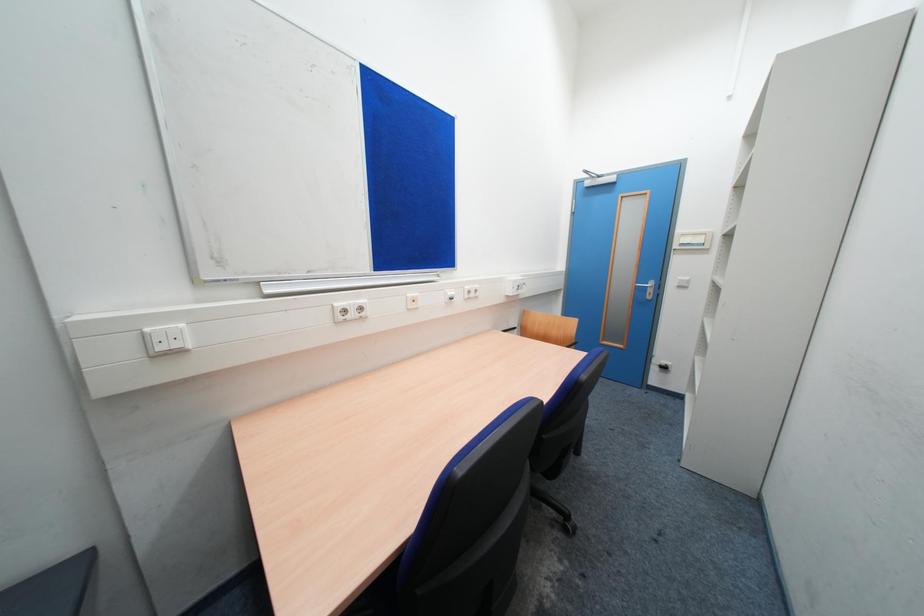
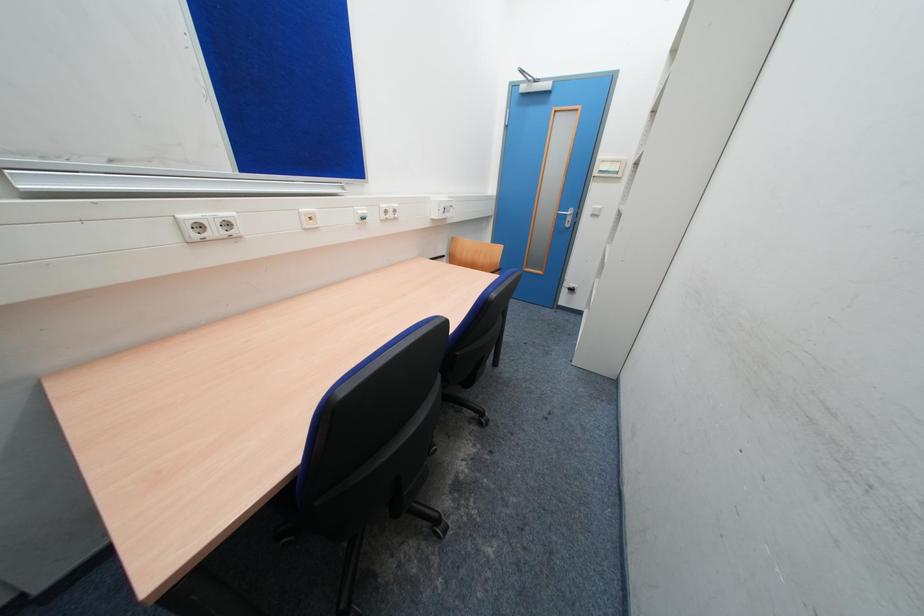
What movement of the cameraman would produce the second image?

The cameraman moved toward right, forward.